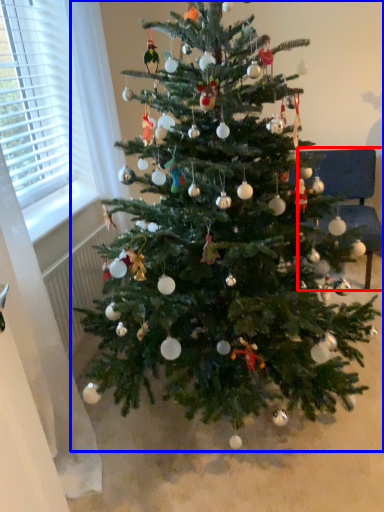
Question: Which of the following is the farthest to the observer, armchair (highlighted by a red box) or christmas tree (highlighted by a blue box)?

Choices:
 (A) armchair
 (B) christmas tree

Answer: (A)